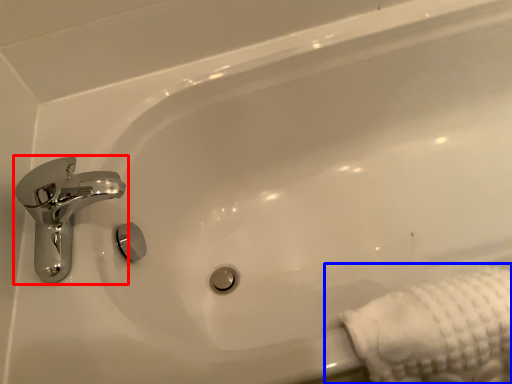
Question: Which point is further to the camera, tap (highlighted by a red box) or bath towel (highlighted by a blue box)?

Choices:
 (A) tap
 (B) bath towel

Answer: (A)